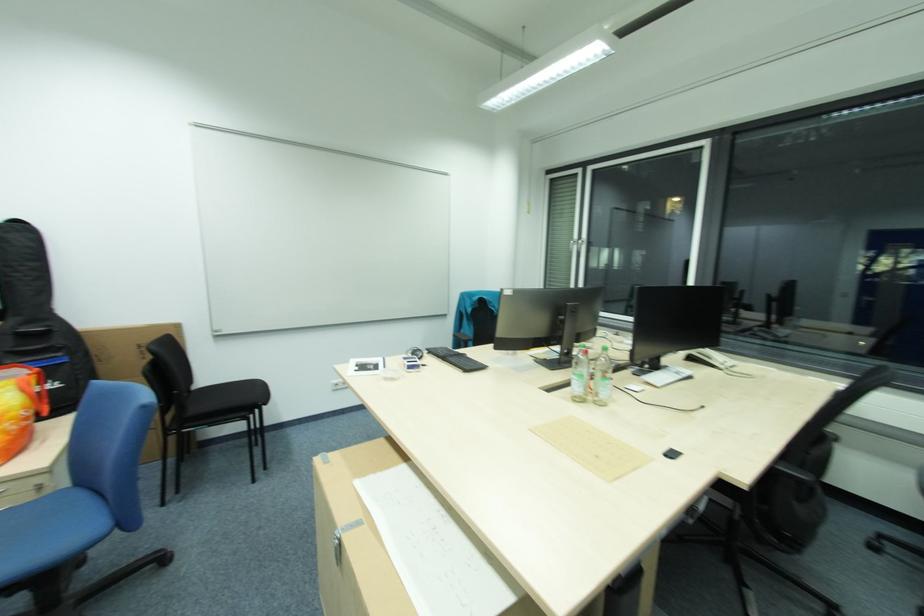
Identify the location of blue chair sitting surface. This screenshot has width=924, height=616. (50, 532).